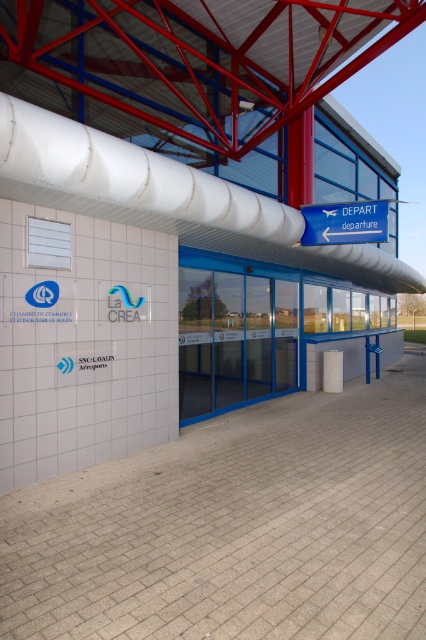
Question: Is blue plastic sign at upper center thinner than white concrete pillar at center?

Choices:
 (A) no
 (B) yes

Answer: (A)

Question: Does blue plastic sign at upper center appear over white concrete pillar at center?

Choices:
 (A) yes
 (B) no

Answer: (A)

Question: Which point is closer to the camera taking this photo?

Choices:
 (A) (325, 387)
 (B) (365, 225)

Answer: (B)

Question: Is blue plastic sign at upper center positioned in front of white concrete pillar at center?

Choices:
 (A) no
 (B) yes

Answer: (B)

Question: Which point appears closest to the camera in this image?

Choices:
 (A) (342, 374)
 (B) (351, 212)

Answer: (B)